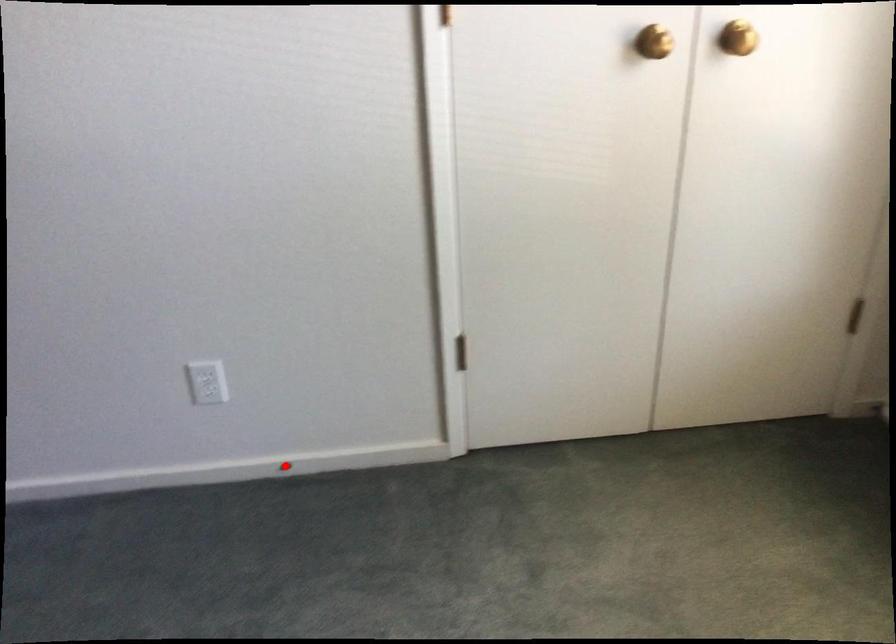
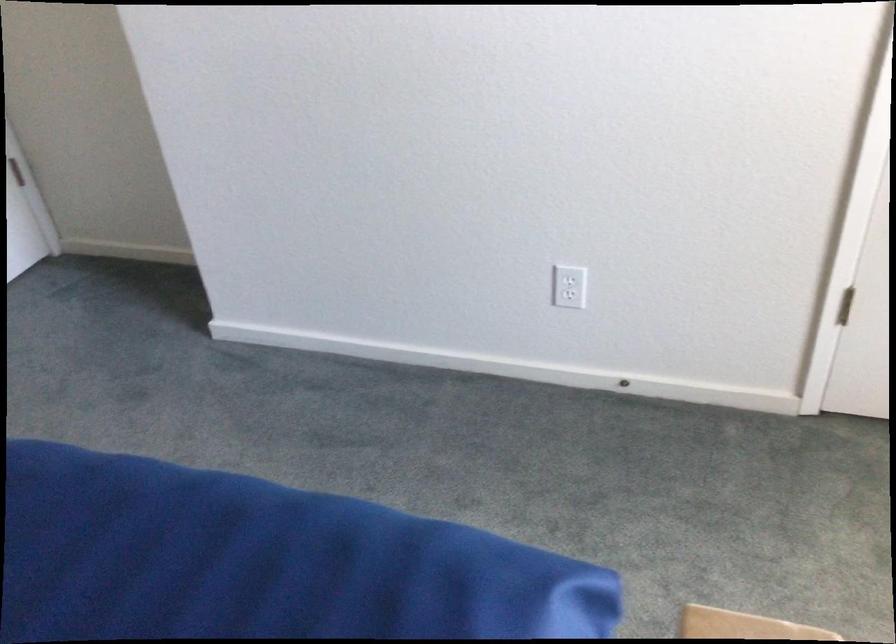
Find the pixel in the second image that matches the highlighted location in the first image.

(624, 384)